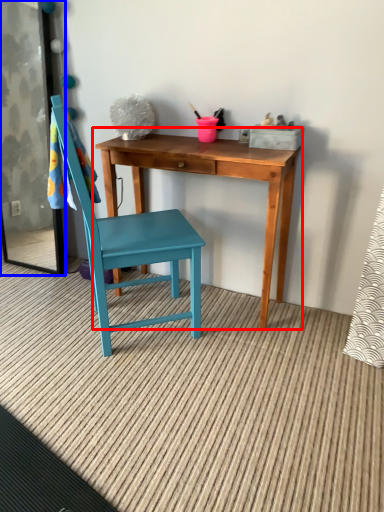
Question: Which object appears farthest to the camera in this image, table (highlighted by a red box) or screen door (highlighted by a blue box)?

Choices:
 (A) table
 (B) screen door

Answer: (B)